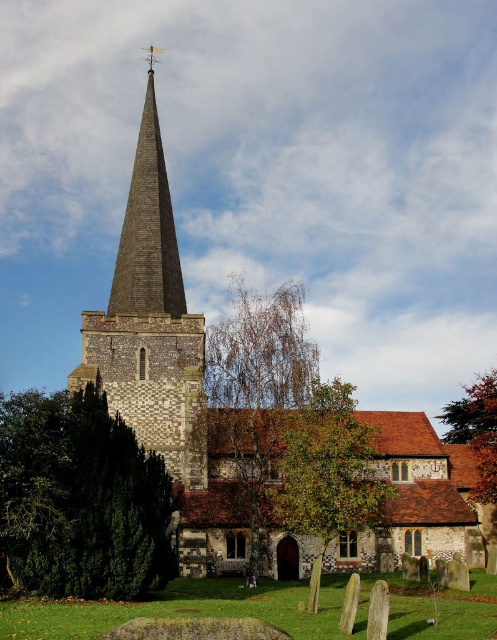
Question: Considering the real-world distances, which object is closest to the brown brick steeple at upper left?

Choices:
 (A) dark brown shingles spire at upper center
 (B) green leafy tree at center
 (C) brown textured tree at center
 (D) brown textured tree at upper right

Answer: (A)

Question: Which point appears closest to the camera in this image?

Choices:
 (A) (361, 456)
 (B) (482, 518)
 (C) (245, 506)

Answer: (A)

Question: Can you confirm if dark green leafy tree at lower left is positioned above brown brick steeple at upper left?

Choices:
 (A) yes
 (B) no

Answer: (B)

Question: In this image, where is dark gray stone church steeple at center located relative to dark green leafy tree at lower left?

Choices:
 (A) below
 (B) above

Answer: (B)

Question: Based on their relative distances, which object is farther from the brown textured tree at center?

Choices:
 (A) brown brick steeple at upper left
 (B) brown textured tree at upper right
 (C) green leafy tree at center

Answer: (B)

Question: Considering the relative positions of dark gray stone church steeple at center and dark green leafy tree at lower left in the image provided, where is dark gray stone church steeple at center located with respect to dark green leafy tree at lower left?

Choices:
 (A) left
 (B) right

Answer: (B)